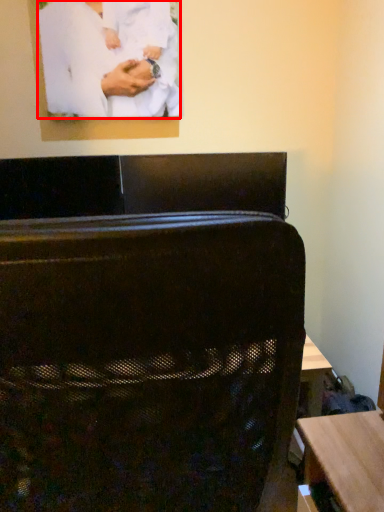
Question: Considering the relative positions of person (annotated by the red box) and furniture in the image provided, where is person (annotated by the red box) located with respect to the staircase?

Choices:
 (A) left
 (B) right

Answer: (A)